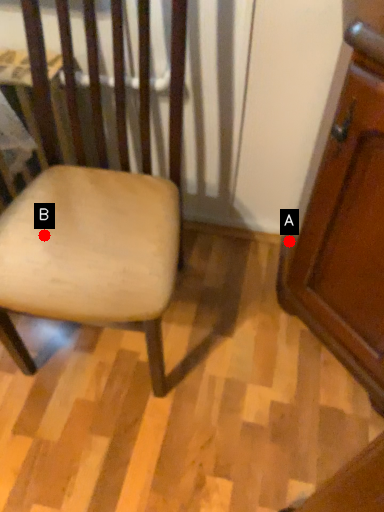
Question: Two points are circled on the image, labeled by A and B beside each circle. Which point is closer to the camera taking this photo?

Choices:
 (A) A is closer
 (B) B is closer

Answer: (B)